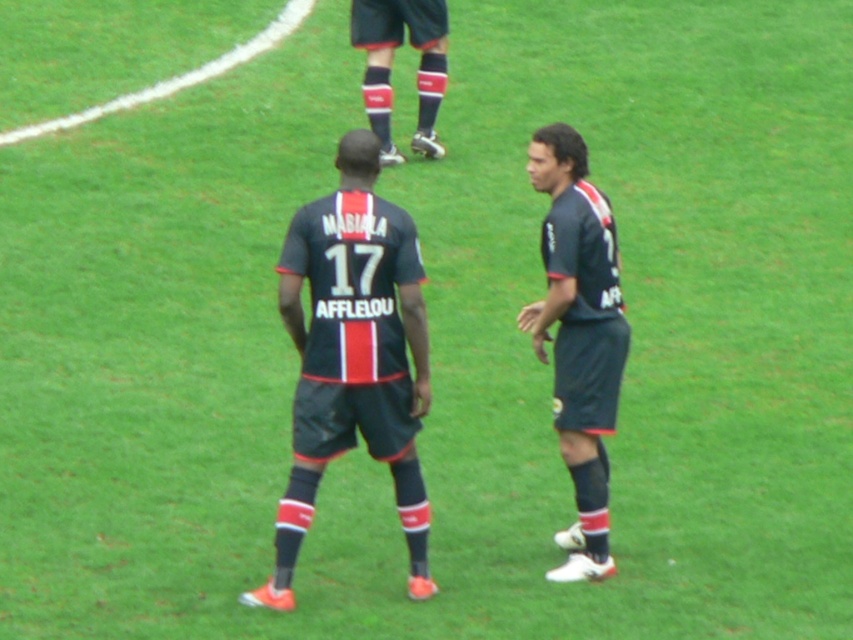
Does dark blue jersey at center appear on the right side of matte dark blue jersey at right?

Incorrect, dark blue jersey at center is not on the right side of matte dark blue jersey at right.

Does point (381, 417) lie behind point (593, 502)?

No, it is not.

Is point (300, 522) positioned after point (608, 358)?

That is False.

The height and width of the screenshot is (640, 853). I want to click on dark blue jersey at center, so click(352, 356).

Does dark blue jersey at center have a lesser width compared to matte black socks at upper center?

In fact, dark blue jersey at center might be wider than matte black socks at upper center.

Can you confirm if dark blue jersey at center is taller than matte black socks at upper center?

Yes, dark blue jersey at center is taller than matte black socks at upper center.

Is point (318, 227) positioned before point (444, 67)?

Yes, point (318, 227) is closer to viewer.

Locate an element on the screen. The height and width of the screenshot is (640, 853). dark blue jersey at center is located at coordinates (352, 356).

In the scene shown: Is matte dark blue jersey at right positioned in front of matte black socks at upper center?

That is True.

Does matte dark blue jersey at right lie behind matte black socks at upper center?

No.

You are a GUI agent. You are given a task and a screenshot of the screen. Output one action in this format:
    pyautogui.click(x=<x>, y=<y>)
    Task: Click on the matte dark blue jersey at right
    The height and width of the screenshot is (640, 853).
    Given the screenshot: What is the action you would take?
    pyautogui.click(x=578, y=336)